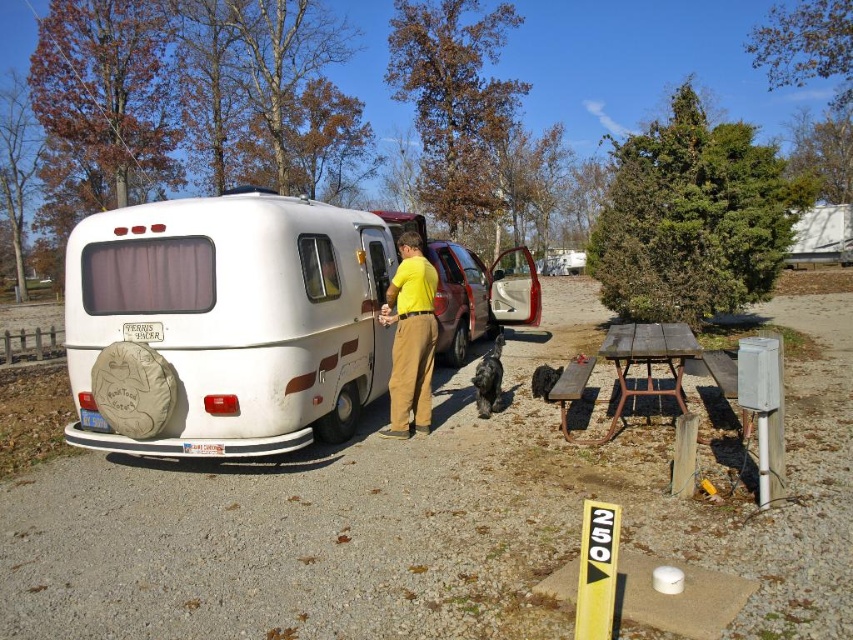
Question: Which of the following is the farthest from the observer?

Choices:
 (A) (341, 307)
 (B) (608, 342)

Answer: (A)

Question: Which of the following is the closest to the observer?

Choices:
 (A) (633, 388)
 (B) (105, 216)
 (C) (428, 296)

Answer: (B)

Question: Does yellow cotton shirt at center appear on the right side of weathered wood picnic table at lower right?

Choices:
 (A) no
 (B) yes

Answer: (A)

Question: Is white matte van at center to the right of weathered wood picnic table at lower right from the viewer's perspective?

Choices:
 (A) no
 (B) yes

Answer: (A)

Question: Among these points, which one is farthest from the camera?

Choices:
 (A) (337, 225)
 (B) (426, 273)
 (C) (680, 340)

Answer: (B)

Question: Does white matte van at center appear on the right side of weathered wood picnic table at lower right?

Choices:
 (A) yes
 (B) no

Answer: (B)